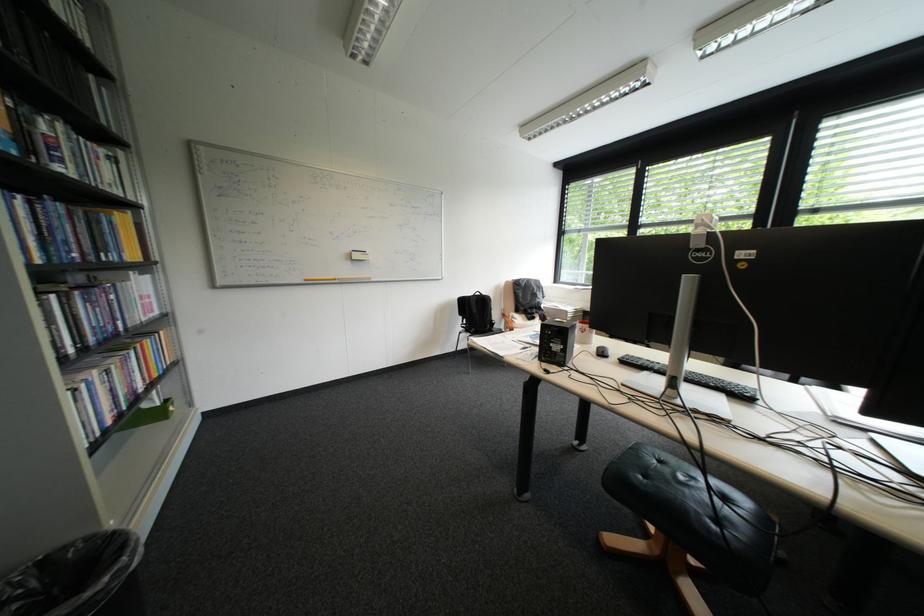
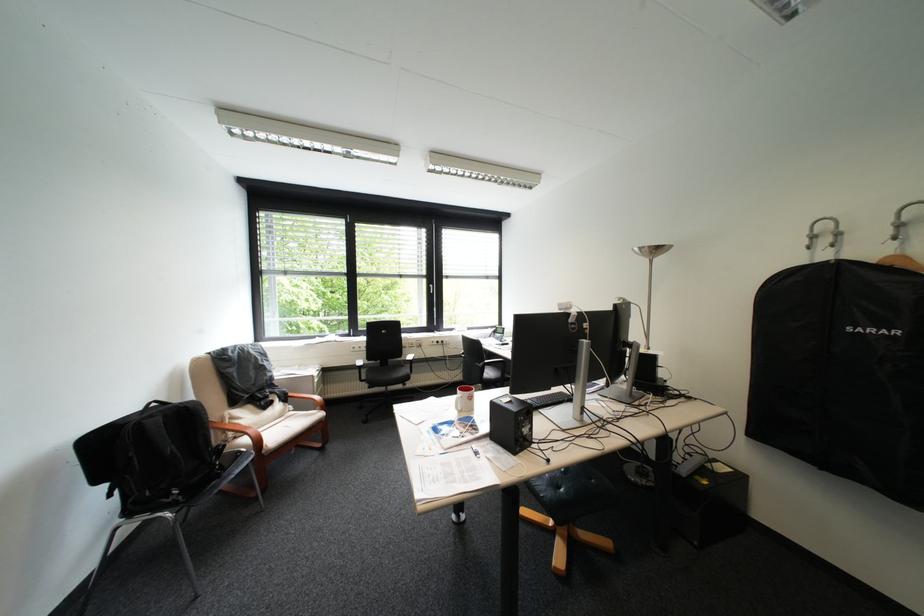
In the second image, find the point that corresponds to (x=548, y=304) in the first image.

(280, 381)